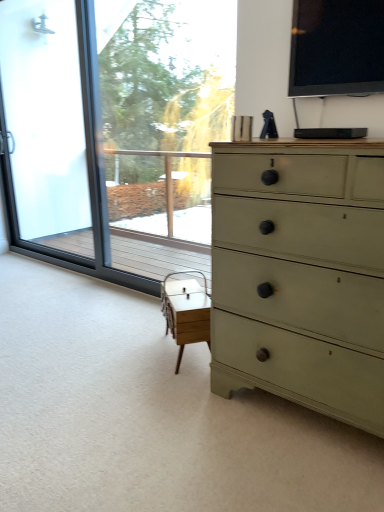
The height and width of the screenshot is (512, 384). Find the location of `vacant space to the left of matte green dresser at right`. vacant space to the left of matte green dresser at right is located at coordinates (178, 419).